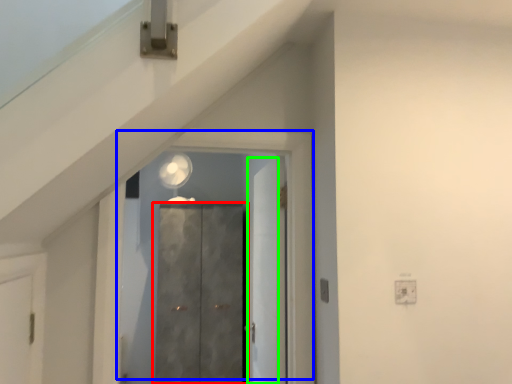
Question: Which object is the farthest from door (highlighted by a red box)? Choose among these: door (highlighted by a blue box) or door (highlighted by a green box).

Choices:
 (A) door
 (B) door

Answer: (A)